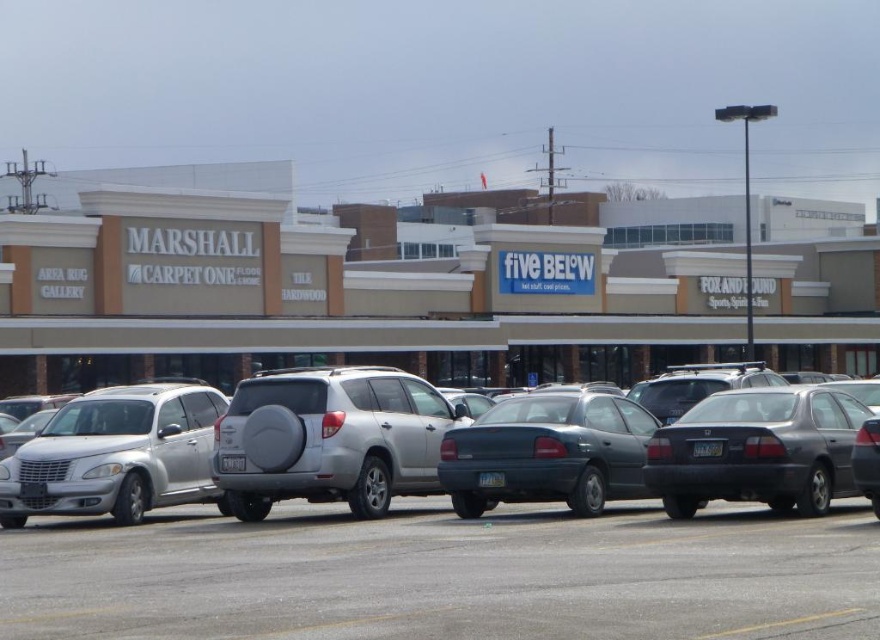
You are a delivery driver who needs to park your vehicle in the parking lot adjacent to the strip mall. You see a silver metallic suv at center and a dark gray matte sedan at center. Which vehicle is positioned lower in the parking lot?

The silver metallic suv at center is located below dark gray matte sedan at center, so it is positioned lower in the parking lot.